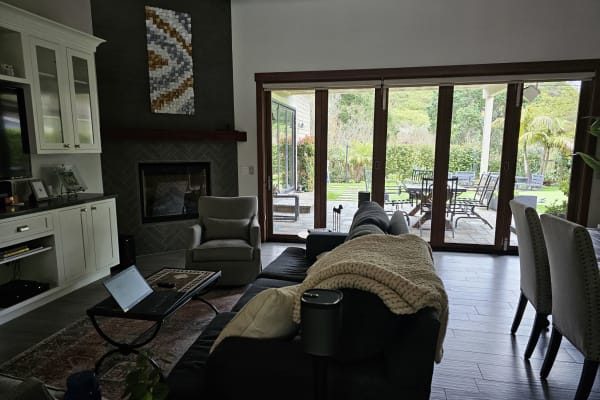
You are a GUI agent. You are given a task and a screenshot of the screen. Output one action in this format:
    pyautogui.click(x=<x>, y=<y>)
    Task: Click on the throw blanket
    This screenshot has width=600, height=400.
    Given the screenshot: What is the action you would take?
    pyautogui.click(x=405, y=303)